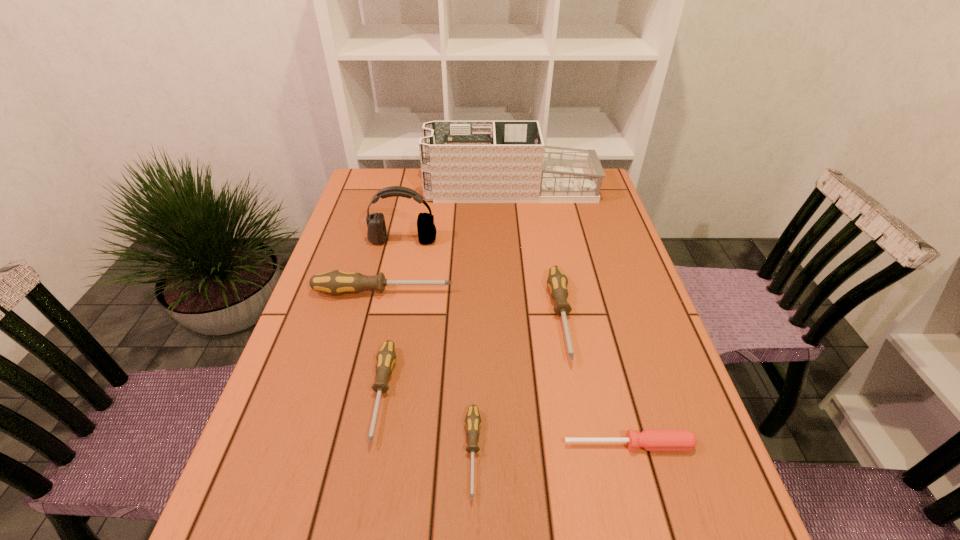
This screenshot has width=960, height=540. I want to click on free spot between the farthest object and the third screwdriver from left to right, so click(492, 321).

This screenshot has height=540, width=960. Find the location of `vacant area that lies between the rightmost gray screwdriver and the fifth shortest object`. vacant area that lies between the rightmost gray screwdriver and the fifth shortest object is located at coordinates (472, 305).

Where is `vacant area that lies between the tallest screwdriver and the second smallest gray screwdriver`? This screenshot has height=540, width=960. vacant area that lies between the tallest screwdriver and the second smallest gray screwdriver is located at coordinates (383, 343).

Locate an element on the screen. The image size is (960, 540). free space between the third shortest screwdriver and the dollhouse is located at coordinates (446, 291).

Identify the location of free space between the second farthest object and the fourth shortest object. Image resolution: width=960 pixels, height=540 pixels. (482, 279).

This screenshot has width=960, height=540. In order to click on object that ranks as the fifth closest to the headset in this screenshot , I will do `click(472, 420)`.

The image size is (960, 540). What are the coordinates of `the second closest object to the third shortest screwdriver` in the screenshot? It's located at (472, 420).

Where is `screwdriver that is the third closest to the second farthest object`? screwdriver that is the third closest to the second farthest object is located at coordinates (386, 357).

The width and height of the screenshot is (960, 540). Identify the location of screwdriver that stands as the second closest to the rightmost gray screwdriver. (472, 420).

Point out which gray screwdriver is positioned as the nearest to the dollhouse. Please provide its 2D coordinates. Your answer should be formatted as a tuple, i.e. [(x, y)], where the tuple contains the x and y coordinates of a point satisfying the conditions above.

[(557, 282)]